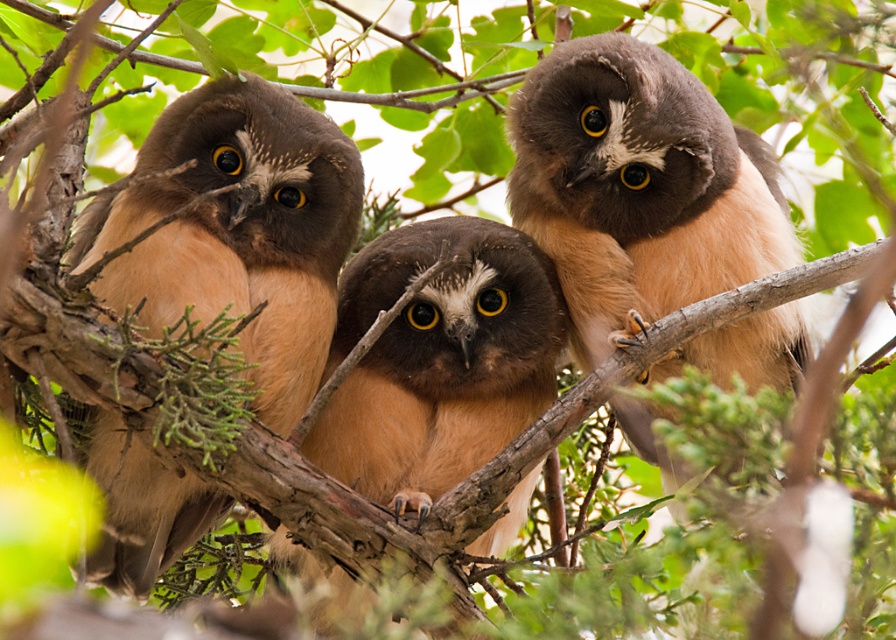
Is brown fuzzy owl at left wider than brown fluffy owl at center?

In fact, brown fuzzy owl at left might be narrower than brown fluffy owl at center.

Is brown fuzzy owl at left thinner than brown fluffy owl at center?

Correct, brown fuzzy owl at left's width is less than brown fluffy owl at center's.

Find the location of a particular element. brown fuzzy owl at left is located at coordinates (237, 230).

Between brown fluffy owl at upper right and brown fluffy owl at center, which one has more height?

Standing taller between the two is brown fluffy owl at upper right.

Is point (574, 200) in front of point (532, 413)?

Yes.

Between point (576, 284) and point (509, 422), which one is positioned behind?

Point (576, 284)

What are the coordinates of `brown fluffy owl at upper right` in the screenshot? It's located at (638, 188).

Can you confirm if brown fuzzy owl at left is positioned to the left of brown fluffy owl at upper right?

Indeed, brown fuzzy owl at left is positioned on the left side of brown fluffy owl at upper right.

Between brown fuzzy owl at left and brown fluffy owl at upper right, which one appears on the left side from the viewer's perspective?

Positioned to the left is brown fuzzy owl at left.

Describe the element at coordinates (237, 230) in the screenshot. I see `brown fuzzy owl at left` at that location.

Where is `brown fuzzy owl at left`? The width and height of the screenshot is (896, 640). brown fuzzy owl at left is located at coordinates (237, 230).